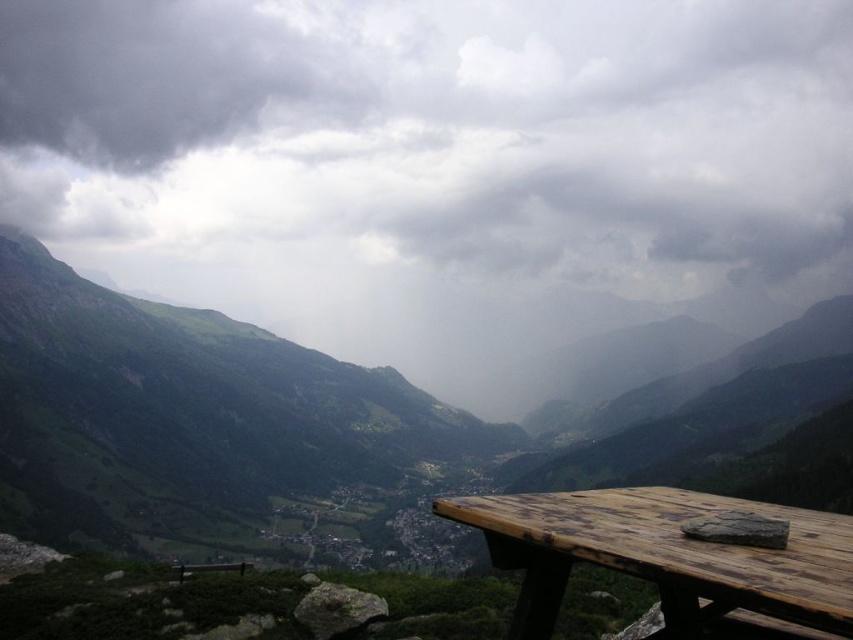
Can you confirm if wooden table at lower right is positioned to the left of brown wooden bench at lower center?

No, wooden table at lower right is not to the left of brown wooden bench at lower center.

Between point (846, 300) and point (241, 566), which one is positioned in front?

Positioned in front is point (241, 566).

Is point (469, 442) positioned before point (247, 566)?

That is False.

Locate an element on the screen. This screenshot has width=853, height=640. wooden table at lower right is located at coordinates (331, 429).

Is point (646, 248) in front of point (827, 392)?

No, it is not.

Is point (785, 29) positioned after point (125, 316)?

Yes, point (785, 29) is farther from viewer.

The width and height of the screenshot is (853, 640). What are the coordinates of `cloudy sky at upper center` in the screenshot? It's located at (434, 136).

Is cloudy sky at upper center further to camera compared to brown wooden bench at lower center?

Yes, it is.

Between cloudy sky at upper center and brown wooden bench at lower center, which one is positioned lower?

brown wooden bench at lower center

Where is `cloudy sky at upper center`? cloudy sky at upper center is located at coordinates (434, 136).